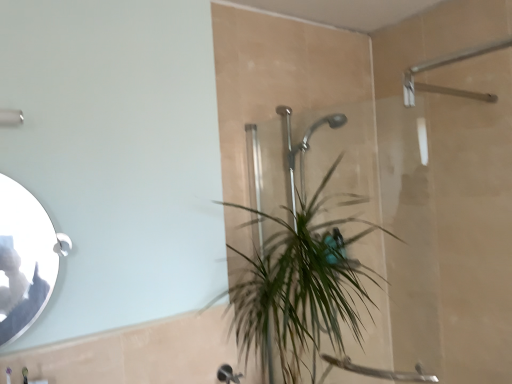
Question: From a real-world perspective, is green leafy plant at center physically located above or below silver/metallic mirror at left?

Choices:
 (A) above
 (B) below

Answer: (B)

Question: From the image's perspective, is green leafy plant at center positioned above or below silver/metallic mirror at left?

Choices:
 (A) below
 (B) above

Answer: (A)

Question: Estimate the real-world distances between objects in this image. Which object is farther from the green leafy plant at center?

Choices:
 (A) matte silver shower at upper left
 (B) silver/metallic mirror at left

Answer: (A)

Question: Which object is positioned closest to the green leafy plant at center?

Choices:
 (A) silver/metallic mirror at left
 (B) matte silver shower at upper left

Answer: (A)